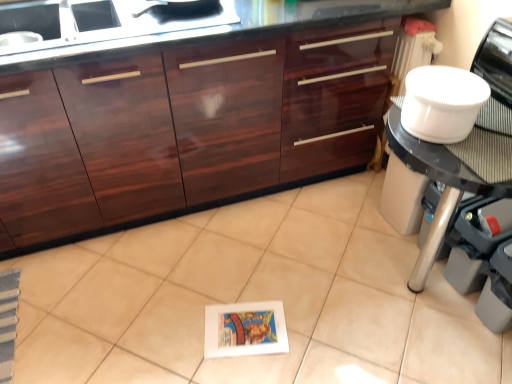
Find the location of a particular element. This screenshot has width=512, height=384. free space below white paper book at center (from a real-world perspective) is located at coordinates (248, 329).